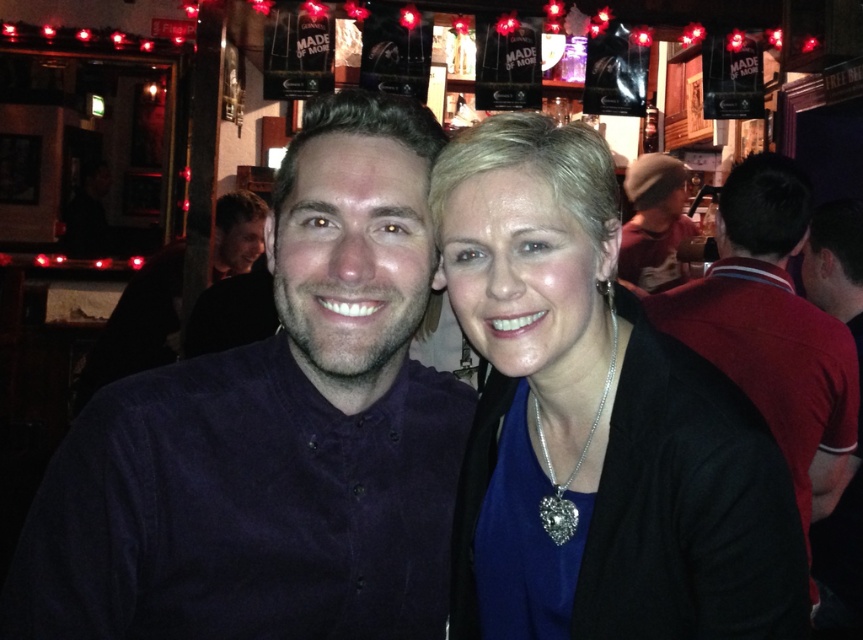
Question: From the image, what is the correct spatial relationship of dark blue corduroy shirt at center in relation to brown knit hat at upper right?

Choices:
 (A) right
 (B) left

Answer: (B)

Question: Which point is farther to the camera?

Choices:
 (A) (627, 316)
 (B) (635, 216)
 (C) (279, 538)
 (D) (709, 300)

Answer: (B)

Question: Among these objects, which one is nearest to the camera?

Choices:
 (A) brown knit hat at upper right
 (B) dark blue corduroy shirt at center
 (C) dark red shirt at right
 (D) matte black sweater at center

Answer: (B)

Question: Is matte black sweater at center bigger than dark red shirt at right?

Choices:
 (A) yes
 (B) no

Answer: (B)

Question: Is dark red shirt at right behind brown knit hat at upper right?

Choices:
 (A) yes
 (B) no

Answer: (B)

Question: Which of the following is the closest to the observer?

Choices:
 (A) (742, 227)
 (B) (556, 260)
 (C) (395, 602)

Answer: (B)